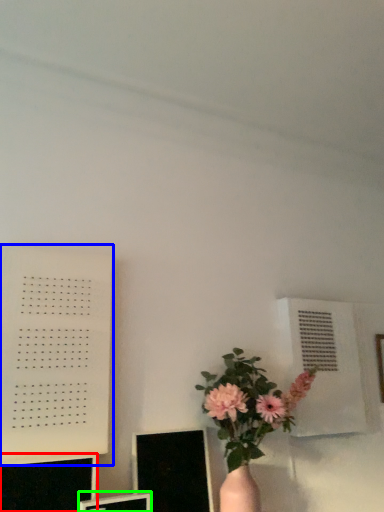
Question: Considering the real-world distances, which object is closest to computer monitor (highlighted by a red box)? bulletin board (highlighted by a blue box) or computer monitor (highlighted by a green box).

Choices:
 (A) bulletin board
 (B) computer monitor

Answer: (B)